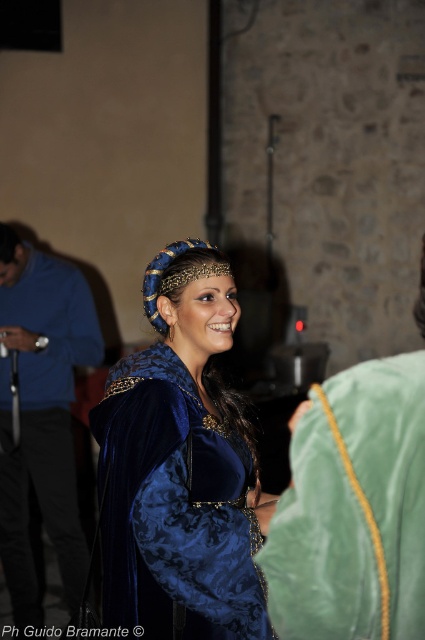
You are a stagehand preparing for a performance and need to ensure there is enough space between the green velvet robe at center and the velvet blue robe at center for a performer to move comfortably. The minimum required space is 10 feet. Is the current distance sufficient?

The green velvet robe at center and the velvet blue robe at center are 10.12 feet apart from each other, which exceeds the minimum required space of 10 feet. Therefore, the current distance is sufficient for the performer to move comfortably.

You are a photographer at this event. You need to position a spotlight so it can illuminate both the velvet blue dress at center and the green velvet robe at center without overlapping the light beams. Given their heights, which object should have its spotlight placed higher?

The velvet blue dress at center is taller than the green velvet robe at center, so the spotlight for the velvet blue dress at center should be placed higher to ensure proper illumination without overlapping the light beams.

You are an event planner setting up a photo shoot at the historical event. You need to position a light source at point 0.797, 0.831 to illuminate the green velvet robe at center. Where should you place the light source relative to the robe?

The light source should be placed at the coordinates [353,509] to directly illuminate the green velvet robe at center.